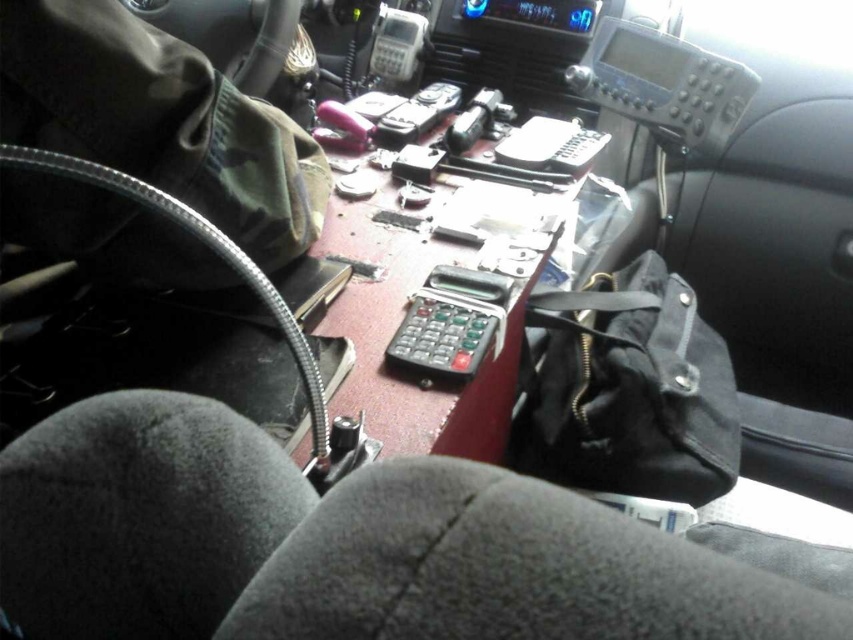
Question: Can you confirm if black canvas bag at center is wider than gray plastic radio at center?

Choices:
 (A) no
 (B) yes

Answer: (B)

Question: Which of the following is the closest to the observer?

Choices:
 (A) (442, 320)
 (B) (393, 19)
 (C) (679, 336)

Answer: (A)

Question: Which point appears farthest from the camera in this image?

Choices:
 (A) (466, 362)
 (B) (393, 10)
 (C) (641, 436)

Answer: (B)

Question: Is black canvas bag at center above gray plastic radio at center?

Choices:
 (A) yes
 (B) no

Answer: (B)

Question: Is black canvas bag at center above gray plastic radio at center?

Choices:
 (A) yes
 (B) no

Answer: (B)

Question: Which object is the farthest from the gray plastic radio at center?

Choices:
 (A) black plastic calculator at center
 (B) black canvas bag at center

Answer: (A)